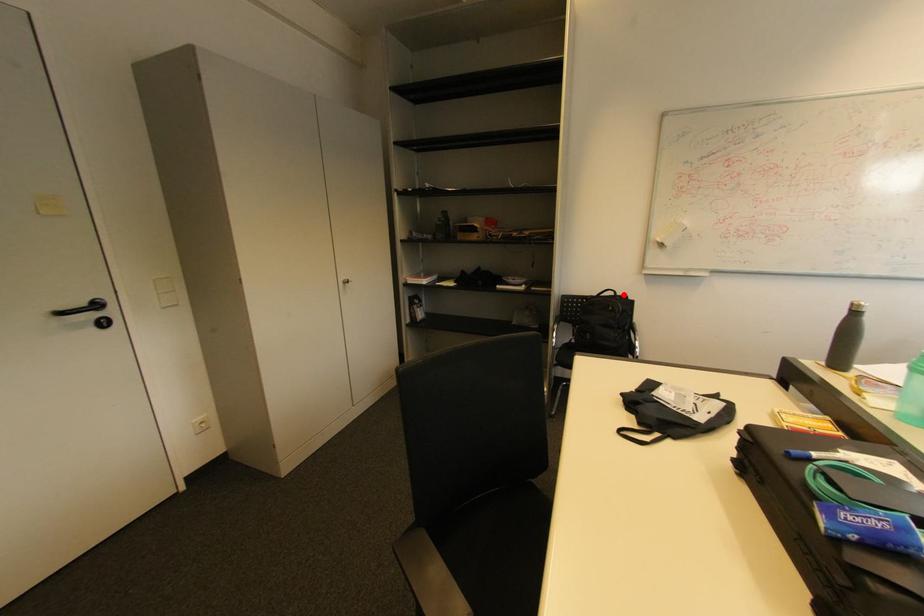
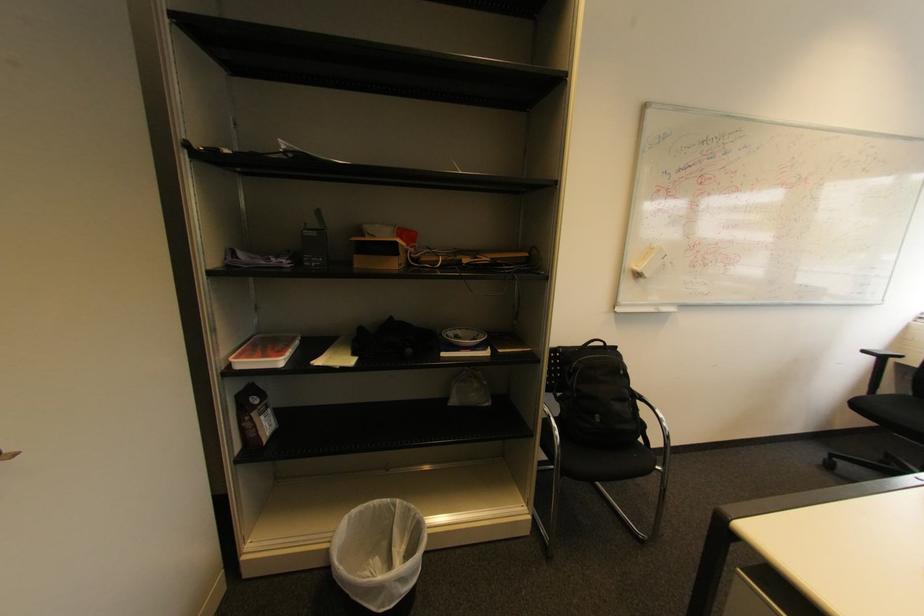
Question: I am providing you with two images of the same scene from different viewpoints. A red point is marked on the first image. Is the red point's position out of view in image 2?

Choices:
 (A) Yes
 (B) No

Answer: (B)